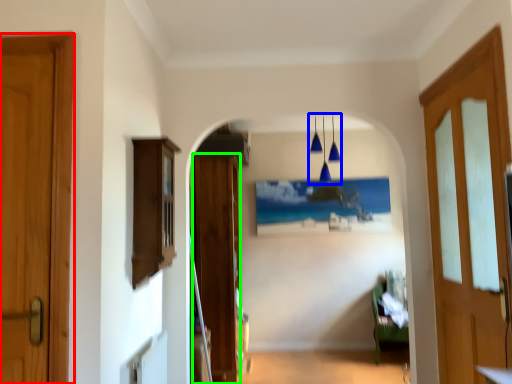
Question: Estimate the real-world distances between objects in this image. Which object is closer to door (highlighted by a red box), light fixture (highlighted by a blue box) or door (highlighted by a green box)?

Choices:
 (A) light fixture
 (B) door

Answer: (B)